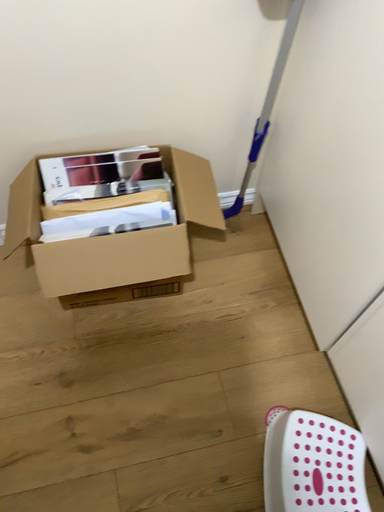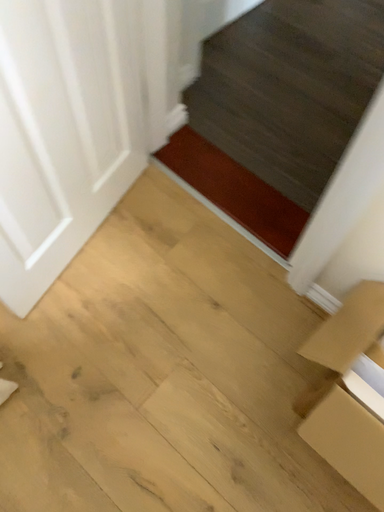
Question: Which way did the camera rotate in the video?

Choices:
 (A) rotated downward
 (B) rotated upward

Answer: (B)